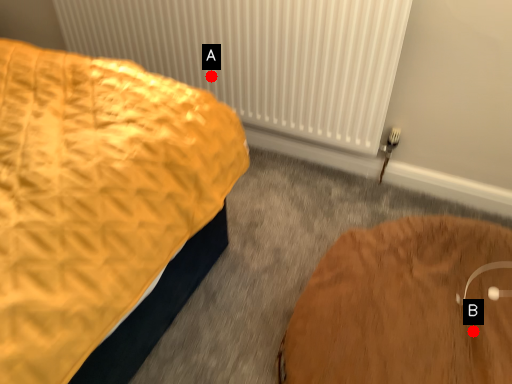
Question: Two points are circled on the image, labeled by A and B beside each circle. Which point appears farthest from the camera in this image?

Choices:
 (A) A is further
 (B) B is further

Answer: (A)